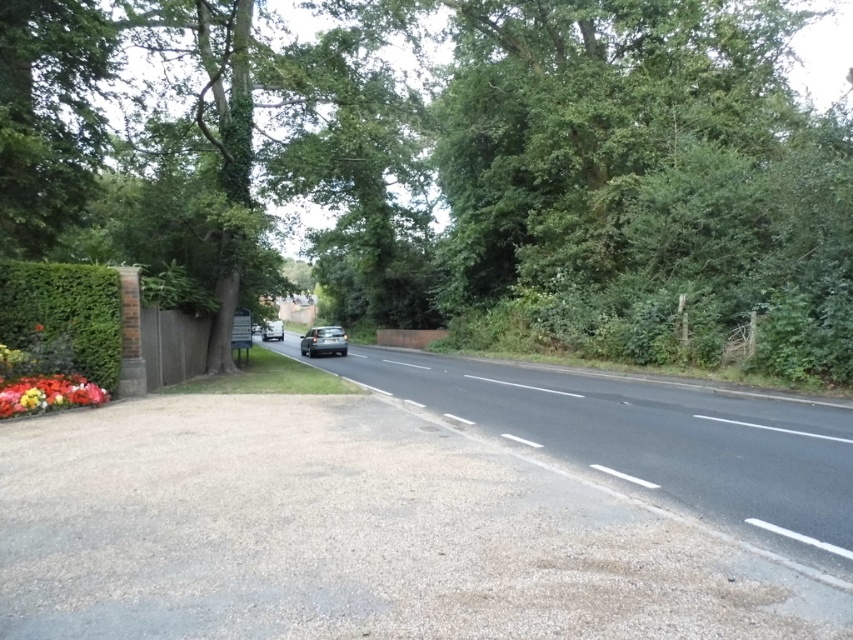
Question: Does green leafy tree at center have a smaller size compared to silver metallic car at center?

Choices:
 (A) yes
 (B) no

Answer: (B)

Question: Does satin black car at center appear on the right side of silver metallic car at center?

Choices:
 (A) no
 (B) yes

Answer: (B)

Question: Among these objects, which one is nearest to the camera?

Choices:
 (A) gravel driveway at lower left
 (B) black asphalt road at center
 (C) satin black car at center
 (D) green leafy hedge at left

Answer: (A)

Question: Is black asphalt road at center wider than satin black car at center?

Choices:
 (A) yes
 (B) no

Answer: (A)

Question: Which object is positioned farthest from the silver metallic car at center?

Choices:
 (A) multicolored fabric flower at lower left
 (B) gravel driveway at lower left
 (C) green leafy tree at center

Answer: (B)

Question: Estimate the real-world distances between objects in this image. Which object is closer to the black asphalt road at center?

Choices:
 (A) gravel driveway at lower left
 (B) green leafy hedge at left
 (C) green leafy tree at center
 (D) multicolored fabric flower at lower left

Answer: (A)